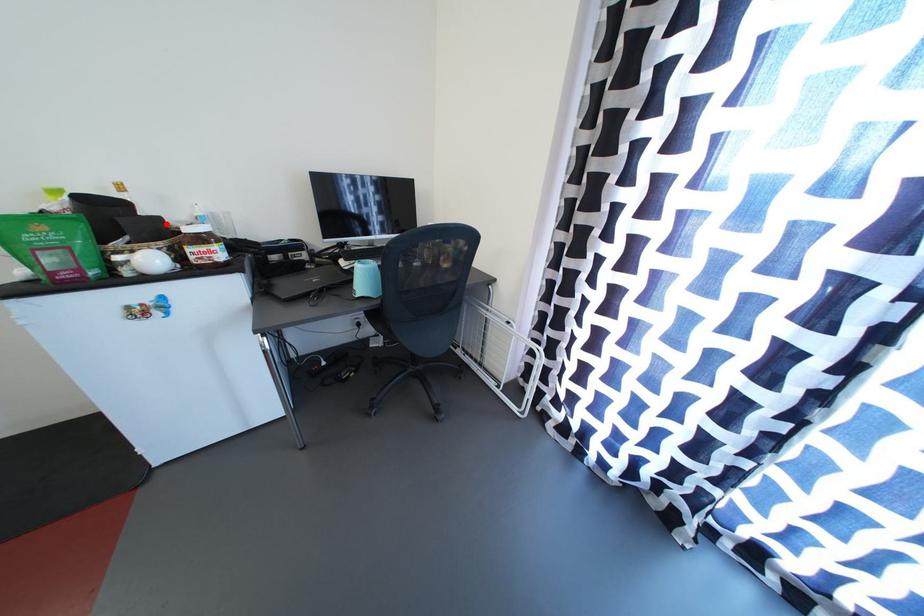
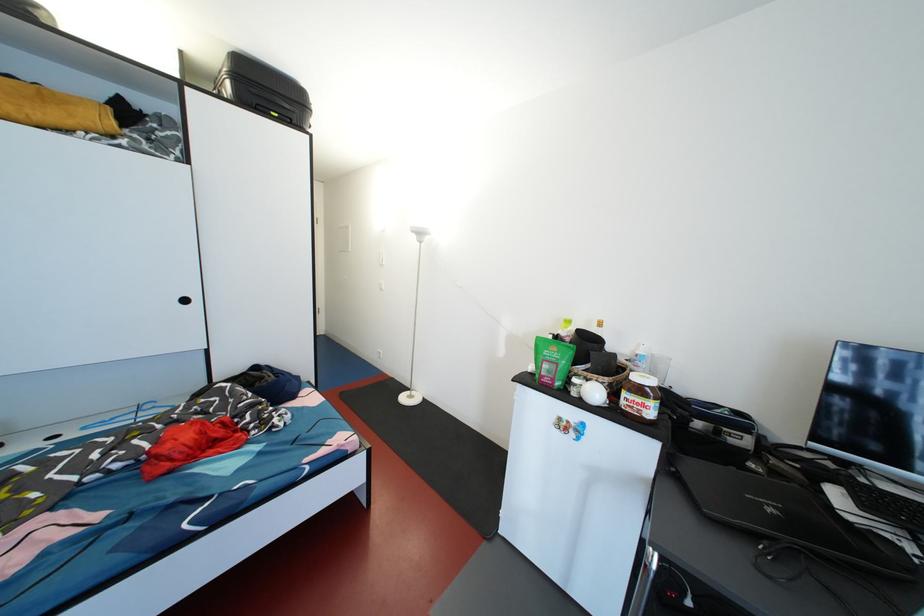
Where in the second image is the point corresponding to the highlighted location from the first image?

(621, 360)